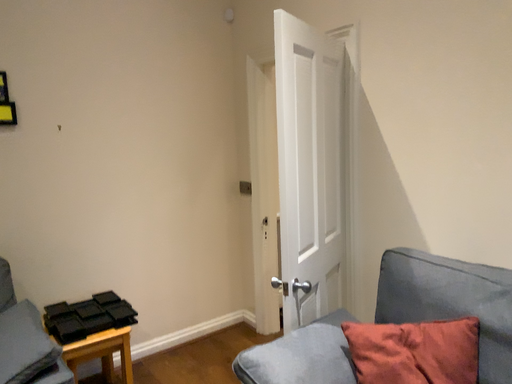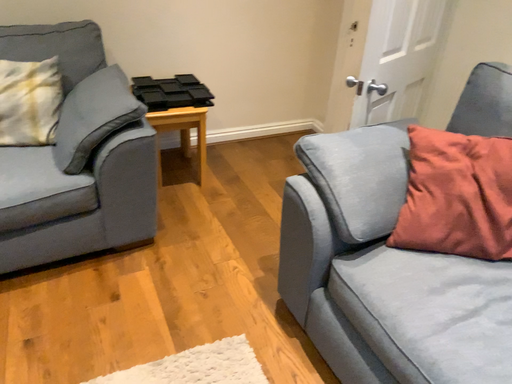
Question: Which way did the camera rotate in the video?

Choices:
 (A) rotated downward
 (B) rotated upward

Answer: (A)